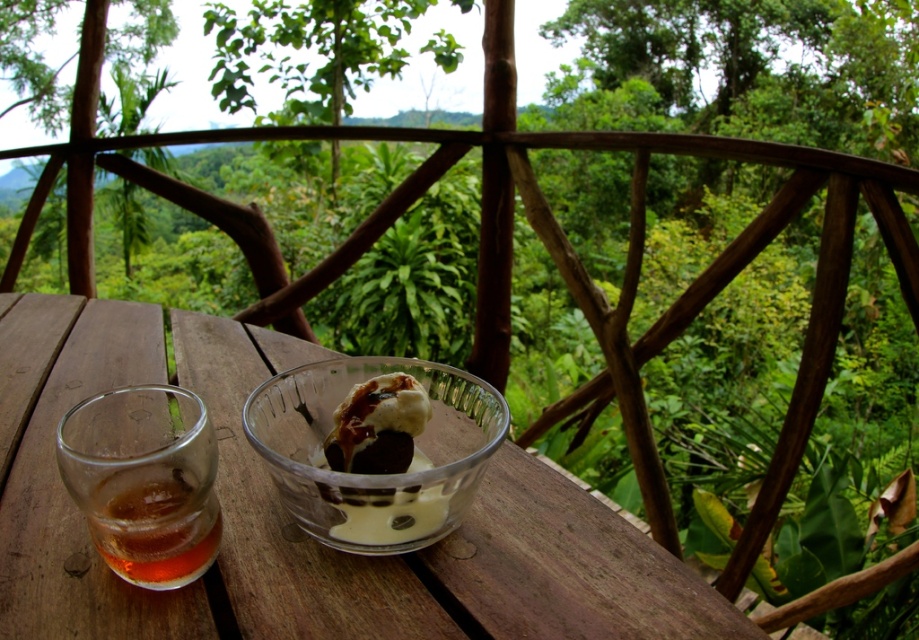
Question: Which point is closer to the camera taking this photo?

Choices:
 (A) (387, 428)
 (B) (126, 445)

Answer: (B)

Question: Does transparent glass table at center have a larger size compared to amber liquid glass at left?

Choices:
 (A) no
 (B) yes

Answer: (B)

Question: Which object is positioned farthest from the translucent glass bowl at center?

Choices:
 (A) amber liquid glass at left
 (B) transparent glass table at center

Answer: (B)

Question: Is amber liquid glass at left behind translucent glass bowl at center?

Choices:
 (A) yes
 (B) no

Answer: (B)

Question: Among these objects, which one is farthest from the camera?

Choices:
 (A) amber liquid glass at left
 (B) translucent glass bowl at center

Answer: (B)

Question: Does amber liquid glass at left appear on the left side of translucent glass bowl at center?

Choices:
 (A) yes
 (B) no

Answer: (A)